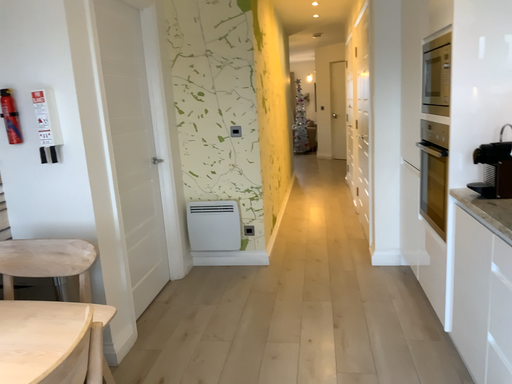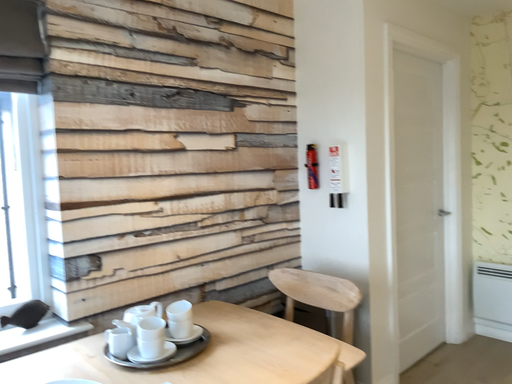
Question: Which way did the camera rotate in the video?

Choices:
 (A) rotated upward
 (B) rotated downward

Answer: (A)